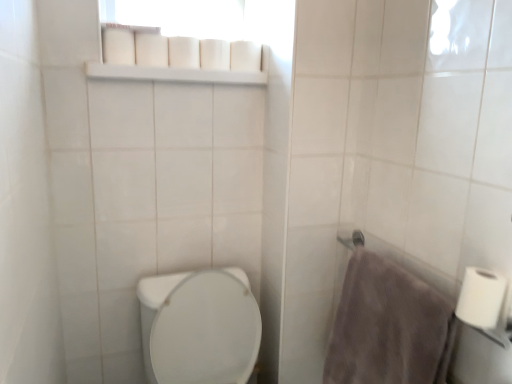
Question: Can you confirm if gray fluffy towel at right is positioned to the right of white matte toilet paper at upper center, acting as the second toilet paper starting from the back?

Choices:
 (A) no
 (B) yes

Answer: (B)

Question: Considering the relative positions of gray fluffy towel at right and white matte toilet paper at upper center, acting as the second toilet paper starting from the back, in the image provided, is gray fluffy towel at right to the left of white matte toilet paper at upper center, acting as the second toilet paper starting from the back, from the viewer's perspective?

Choices:
 (A) yes
 (B) no

Answer: (B)

Question: Is gray fluffy towel at right far from white matte toilet paper at upper center, acting as the second toilet paper starting from the back?

Choices:
 (A) yes
 (B) no

Answer: (A)

Question: Does gray fluffy towel at right contain white matte toilet paper at upper center, acting as the second toilet paper starting from the back?

Choices:
 (A) yes
 (B) no

Answer: (B)

Question: Does gray fluffy towel at right lie behind white matte toilet paper at upper center, the 3th toilet paper when ordered from right to left?

Choices:
 (A) yes
 (B) no

Answer: (B)

Question: From a real-world perspective, is gray fluffy towel at right over white matte toilet paper at upper center, marked as the second toilet paper in a front-to-back arrangement?

Choices:
 (A) no
 (B) yes

Answer: (A)

Question: Are white matte toilet paper at right, which appears as the 1th toilet paper when ordered from the bottom, and white glossy toilet at lower left far apart?

Choices:
 (A) no
 (B) yes

Answer: (A)

Question: From the image's perspective, is white matte toilet paper at right, which appears as the 1th toilet paper when ordered from the bottom, located beneath white glossy toilet at lower left?

Choices:
 (A) no
 (B) yes

Answer: (A)

Question: Is white matte toilet paper at right, which is the 1th toilet paper in right-to-left order, looking in the opposite direction of white glossy toilet at lower left?

Choices:
 (A) yes
 (B) no

Answer: (B)

Question: Does white matte toilet paper at right, positioned as the 3th toilet paper in top-to-bottom order, appear on the right side of white glossy toilet at lower left?

Choices:
 (A) yes
 (B) no

Answer: (A)

Question: Is white matte toilet paper at right, which is the 1th toilet paper in right-to-left order, bigger than white glossy toilet at lower left?

Choices:
 (A) no
 (B) yes

Answer: (A)

Question: Could you tell me if white matte toilet paper at right, positioned as the 3th toilet paper in top-to-bottom order, is turned towards white glossy toilet at lower left?

Choices:
 (A) no
 (B) yes

Answer: (A)

Question: From the image's perspective, is white matte toilet paper at upper center, which ranks as the first toilet paper in back-to-front order, located beneath gray fluffy towel at right?

Choices:
 (A) yes
 (B) no

Answer: (B)